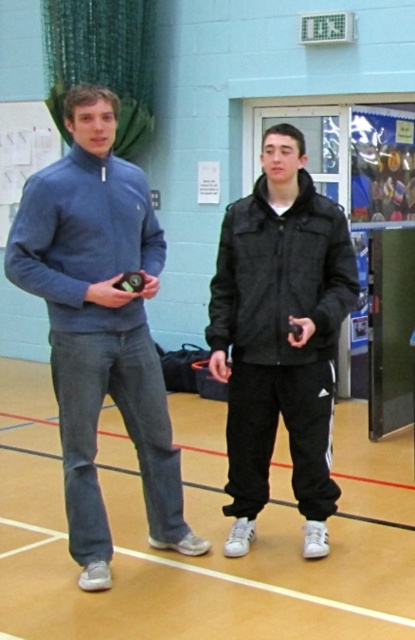
You are organizing a charity clothing drive and need to determine which donated items can fit into a standard donation bin. The bin has a maximum capacity for medium sized clothing items. Based on the image, can the blue fleece sweater at left and the black matte jacket at center both fit into the bin?

The blue fleece sweater at left is larger in size than the black matte jacket at center. Since the bin has a maximum capacity for medium sized clothing items, the black matte jacket at center may fit, but the blue fleece sweater at left is too large to fit into the bin.

You are a fitness trainer preparing to demonstrate an exercise. You need to move from your current position to the front of the room to address the class. There is a blue fleece sweater at left and a black matte jacket at center in the way. Can you walk between them without needing to move either item?

The distance between the blue fleece sweater at left and the black matte jacket at center is 29.22 inches, which is approximately 2.43 feet. Since this space is narrow, a person would likely need to navigate carefully, but it may be possible to walk through without moving the items if the trainer is cautious and the path is clear. However, the tightness of the space might require some maneuvering.